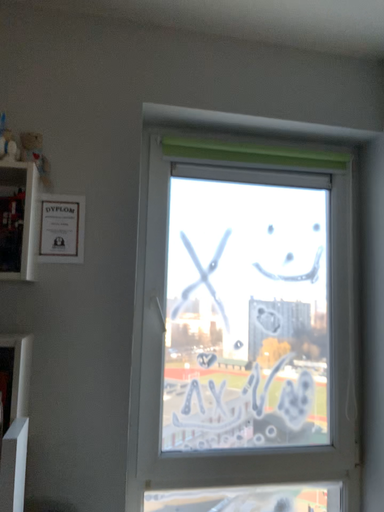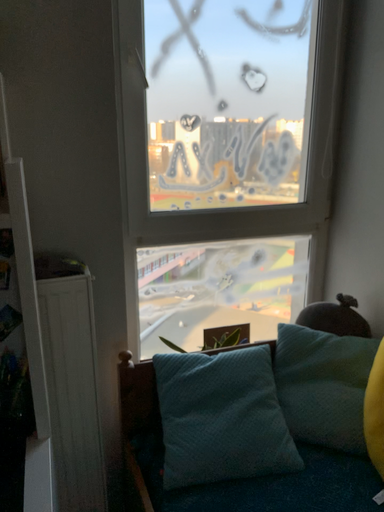
Question: How did the camera likely rotate when shooting the video?

Choices:
 (A) rotated downward
 (B) rotated upward

Answer: (A)